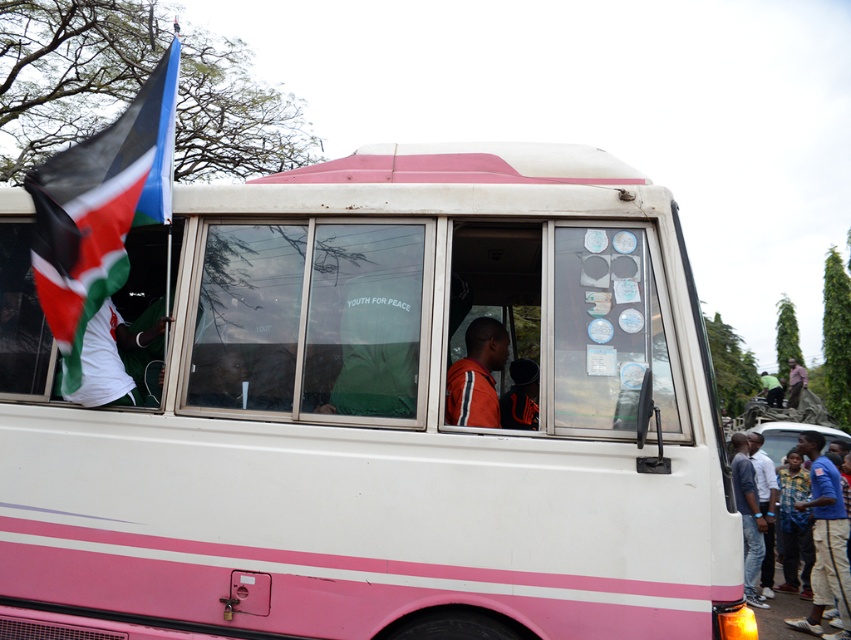
Image resolution: width=851 pixels, height=640 pixels. I want to click on white matte tour bus at center, so click(x=383, y=417).

Between white matte tour bus at center and blue jeans at lower right, which one appears on the right side from the viewer's perspective?

From the viewer's perspective, blue jeans at lower right appears more on the right side.

Who is more distant from viewer, (561, 480) or (761, 513)?

Positioned behind is point (761, 513).

You are a GUI agent. You are given a task and a screenshot of the screen. Output one action in this format:
    pyautogui.click(x=<x>, y=<y>)
    Task: Click on the white matte tour bus at center
    The height and width of the screenshot is (640, 851).
    Given the screenshot: What is the action you would take?
    (x=383, y=417)

Who is positioned more to the left, white matte tour bus at center or blue cotton shirt at lower right?

white matte tour bus at center

Where is `white matte tour bus at center`? The image size is (851, 640). white matte tour bus at center is located at coordinates (383, 417).

This screenshot has height=640, width=851. I want to click on white matte tour bus at center, so click(x=383, y=417).

Is tri-color fabric flag at left further to camera compared to blue jeans at lower right?

No, tri-color fabric flag at left is in front of blue jeans at lower right.

Is point (123, 134) less distant than point (766, 547)?

That is True.

Is point (123, 147) less distant than point (766, 528)?

Yes, point (123, 147) is in front of point (766, 528).

This screenshot has width=851, height=640. What are the coordinates of `tri-color fabric flag at left` in the screenshot? It's located at (100, 209).